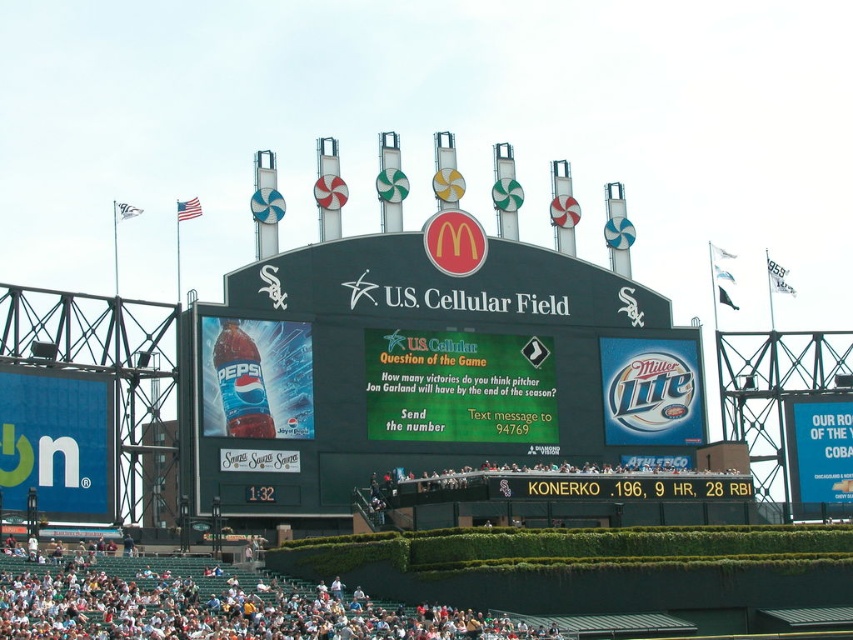
Between black matte scoreboard at center and white plastic seats at lower center, which one is positioned lower?

white plastic seats at lower center

Is black matte scoreboard at center bigger than white plastic seats at lower center?

Indeed, black matte scoreboard at center has a larger size compared to white plastic seats at lower center.

Which is in front, point (492, 308) or point (370, 620)?

Point (370, 620) is in front.

Where is `black matte scoreboard at center`? black matte scoreboard at center is located at coordinates (427, 371).